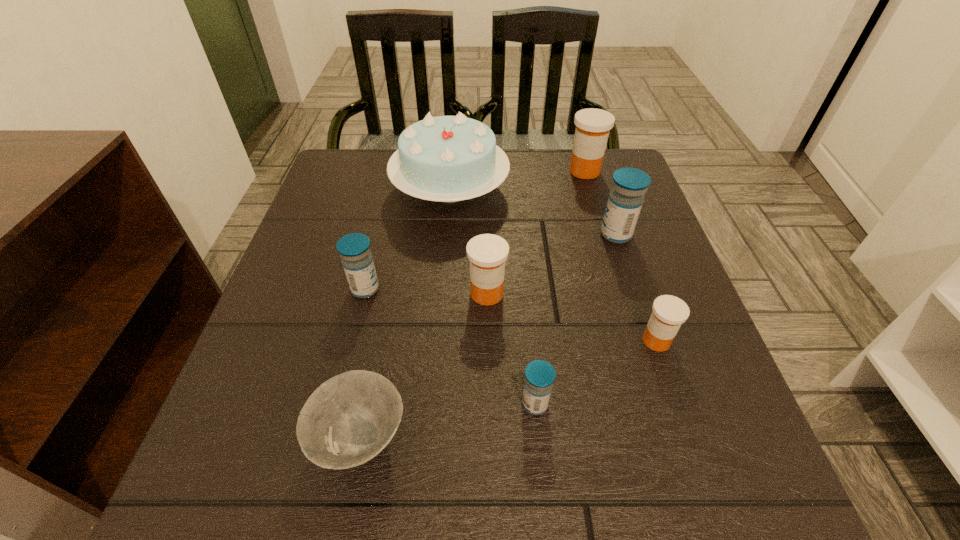
The image size is (960, 540). In order to click on free space located 0.260m on the right of the leftmost blue medicine in this screenshot , I will do `click(512, 289)`.

Locate an element on the screen. Image resolution: width=960 pixels, height=540 pixels. blank space located 0.210m on the label of the leftmost orange medicine is located at coordinates (489, 411).

Locate an element on the screen. The height and width of the screenshot is (540, 960). free region located 0.380m on the left of the second blue medicine from left to right is located at coordinates (281, 404).

This screenshot has height=540, width=960. I want to click on blank area located on the label of the fifth farthest medicine, so click(x=528, y=341).

Find the location of `free region located on the label of the fifth farthest medicine`. free region located on the label of the fifth farthest medicine is located at coordinates (489, 341).

Find the location of a particular element. Image resolution: width=960 pixels, height=540 pixels. free space located on the label of the fifth farthest medicine is located at coordinates (466, 341).

Where is `vacant space situated 0.350m on the back of the bowl`? This screenshot has width=960, height=540. vacant space situated 0.350m on the back of the bowl is located at coordinates (396, 248).

Where is `birthday cake present at the far edge`? Image resolution: width=960 pixels, height=540 pixels. birthday cake present at the far edge is located at coordinates (447, 158).

In order to click on medicine that is at the far edge in this screenshot , I will do `click(593, 125)`.

Identify the location of object that is at the near edge. The height and width of the screenshot is (540, 960). (347, 421).